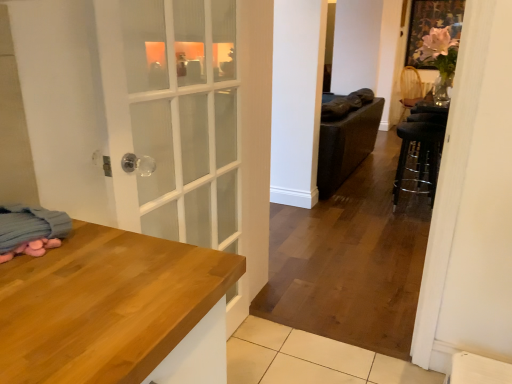
The height and width of the screenshot is (384, 512). Identify the location of vacant region to the left of black metal bar stool at right. point(367,210).